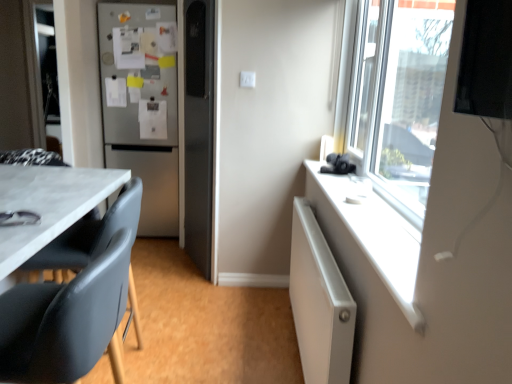
Question: From the image's perspective, does satin silver refrigerator at left appear higher than black leather chair at lower left?

Choices:
 (A) no
 (B) yes

Answer: (B)

Question: Does satin silver refrigerator at left have a greater height compared to black leather chair at lower left?

Choices:
 (A) yes
 (B) no

Answer: (A)

Question: Is satin silver refrigerator at left at the left side of black leather chair at lower left?

Choices:
 (A) no
 (B) yes

Answer: (B)

Question: From a real-world perspective, is satin silver refrigerator at left on top of black leather chair at lower left?

Choices:
 (A) no
 (B) yes

Answer: (B)

Question: Considering the relative positions of satin silver refrigerator at left and black leather chair at lower left in the image provided, is satin silver refrigerator at left in front of black leather chair at lower left?

Choices:
 (A) no
 (B) yes

Answer: (A)

Question: Is satin silver refrigerator at left smaller than black leather chair at lower left?

Choices:
 (A) yes
 (B) no

Answer: (B)

Question: Considering the relative sizes of white plastic window sill at upper right and satin silver refrigerator at left in the image provided, is white plastic window sill at upper right taller than satin silver refrigerator at left?

Choices:
 (A) no
 (B) yes

Answer: (A)

Question: Is white plastic window sill at upper right placed right next to satin silver refrigerator at left?

Choices:
 (A) no
 (B) yes

Answer: (A)

Question: From the image's perspective, is white plastic window sill at upper right below satin silver refrigerator at left?

Choices:
 (A) yes
 (B) no

Answer: (A)

Question: Considering the relative positions of white plastic window sill at upper right and satin silver refrigerator at left in the image provided, is white plastic window sill at upper right to the right of satin silver refrigerator at left from the viewer's perspective?

Choices:
 (A) no
 (B) yes

Answer: (B)

Question: From the image's perspective, is white plastic window sill at upper right on top of satin silver refrigerator at left?

Choices:
 (A) no
 (B) yes

Answer: (A)

Question: Is white plastic window sill at upper right thinner than satin silver refrigerator at left?

Choices:
 (A) yes
 (B) no

Answer: (A)

Question: Can you confirm if black leather chair at lower left is thinner than satin silver refrigerator at left?

Choices:
 (A) yes
 (B) no

Answer: (A)